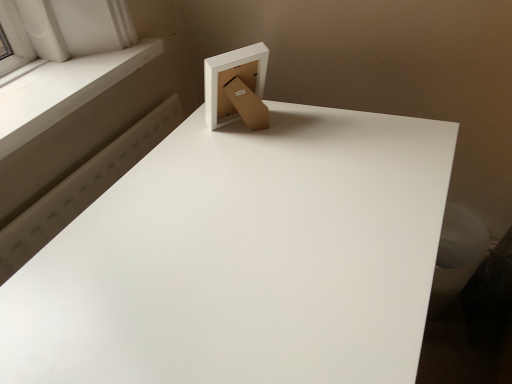
Question: Does white matte table at upper center have a greater width compared to matte cardboard box at upper center?

Choices:
 (A) yes
 (B) no

Answer: (A)

Question: From a real-world perspective, is white matte table at upper center on top of matte cardboard box at upper center?

Choices:
 (A) yes
 (B) no

Answer: (B)

Question: Is white matte table at upper center located outside matte cardboard box at upper center?

Choices:
 (A) no
 (B) yes

Answer: (B)

Question: Is white matte table at upper center taller than matte cardboard box at upper center?

Choices:
 (A) yes
 (B) no

Answer: (A)

Question: Could you tell me if white matte table at upper center is turned towards matte cardboard box at upper center?

Choices:
 (A) no
 (B) yes

Answer: (A)

Question: From the image's perspective, relative to white smooth window sill at upper left, is matte cardboard box at upper center above or below?

Choices:
 (A) above
 (B) below

Answer: (B)

Question: Would you say matte cardboard box at upper center is to the left or to the right of white smooth window sill at upper left in the picture?

Choices:
 (A) right
 (B) left

Answer: (A)

Question: Is matte cardboard box at upper center wider or thinner than white smooth window sill at upper left?

Choices:
 (A) thin
 (B) wide

Answer: (A)

Question: Is matte cardboard box at upper center situated inside white smooth window sill at upper left or outside?

Choices:
 (A) inside
 (B) outside

Answer: (B)

Question: Is white smooth window sill at upper left situated inside white matte table at upper center or outside?

Choices:
 (A) inside
 (B) outside

Answer: (B)

Question: Based on their positions, is white smooth window sill at upper left located to the left or right of white matte table at upper center?

Choices:
 (A) left
 (B) right

Answer: (A)

Question: Is white smooth window sill at upper left wider or thinner than white matte table at upper center?

Choices:
 (A) thin
 (B) wide

Answer: (A)

Question: Is point (36, 112) positioned closer to the camera than point (358, 264)?

Choices:
 (A) closer
 (B) farther

Answer: (B)

Question: From the image's perspective, is white smooth window sill at upper left located above or below matte cardboard box at upper center?

Choices:
 (A) above
 (B) below

Answer: (A)

Question: Does point (111, 77) appear closer or farther from the camera than point (221, 82)?

Choices:
 (A) closer
 (B) farther

Answer: (B)